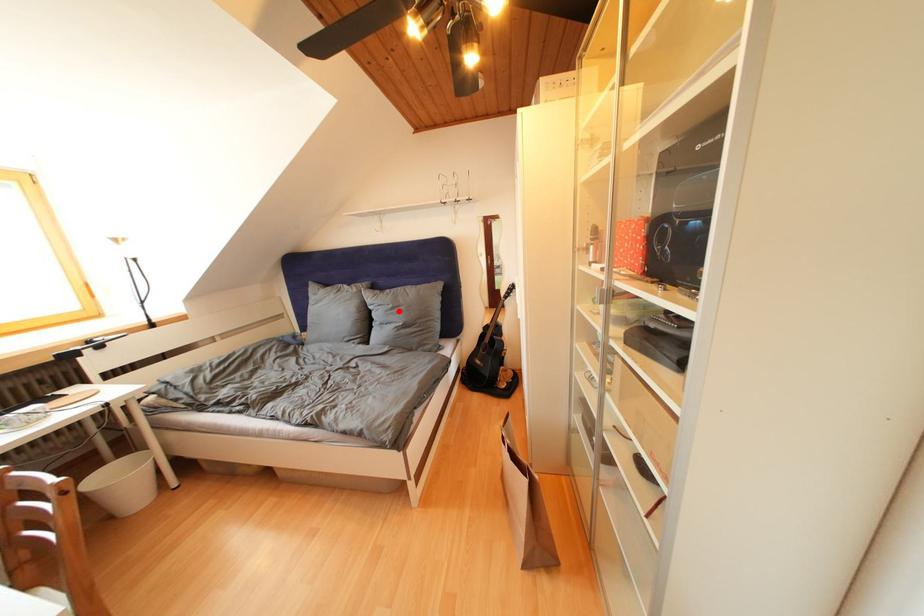
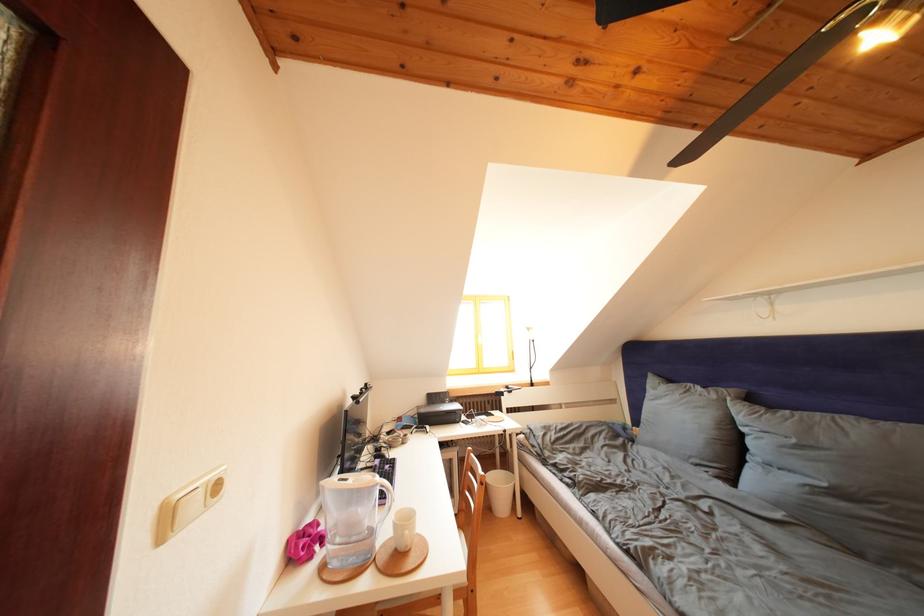
In the second image, find the point that corresponds to the highlighted location in the first image.

(801, 446)